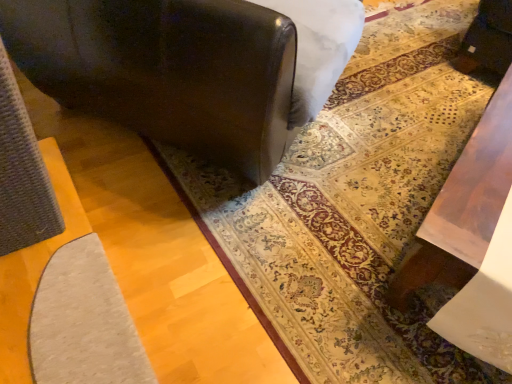
Where is `matte gray rug at center`? The image size is (512, 384). matte gray rug at center is located at coordinates (353, 208).

Image resolution: width=512 pixels, height=384 pixels. What do you see at coordinates (353, 208) in the screenshot?
I see `matte gray rug at center` at bounding box center [353, 208].

Measure the distance between point (253,137) and camera.

1.17 meters.

I want to click on matte black sofa at center, so click(x=167, y=70).

What do you see at coordinates (167, 70) in the screenshot? The width and height of the screenshot is (512, 384). I see `matte black sofa at center` at bounding box center [167, 70].

You are a GUI agent. You are given a task and a screenshot of the screen. Output one action in this format:
    pyautogui.click(x=<x>, y=<y>)
    Task: Click on the matte gray rug at center
    The height and width of the screenshot is (384, 512).
    Given the screenshot: What is the action you would take?
    pyautogui.click(x=353, y=208)

Between matte gray rug at center and matte black sofa at center, which one appears on the right side from the viewer's perspective?

matte gray rug at center is more to the right.

Based on the photo, considering the positions of objects matte gray rug at center and matte black sofa at center in the image provided, who is in front, matte gray rug at center or matte black sofa at center?

matte black sofa at center is closer to the camera.

Is point (237, 241) more distant than point (128, 97)?

Yes, it is behind point (128, 97).

From the image's perspective, is matte gray rug at center located above or below matte black sofa at center?

matte gray rug at center is situated lower than matte black sofa at center in the image.

In the scene shown: From a real-world perspective, which is physically above, matte gray rug at center or matte black sofa at center?

matte black sofa at center, from a real-world perspective.

Between matte gray rug at center and matte black sofa at center, which one has smaller width?

matte black sofa at center is thinner.

From the picture: Who is shorter, matte gray rug at center or matte black sofa at center?

Standing shorter between the two is matte gray rug at center.

Who is bigger, matte gray rug at center or matte black sofa at center?

With larger size is matte black sofa at center.

Could matte black sofa at center be considered to be inside matte gray rug at center?

Actually, matte black sofa at center is outside matte gray rug at center.

In the scene shown: Can you see matte gray rug at center touching matte black sofa at center?

There is a gap between matte gray rug at center and matte black sofa at center.

Is matte gray rug at center positioned with its back to matte black sofa at center?

matte gray rug at center does not have its back to matte black sofa at center.

What's the angular difference between matte gray rug at center and matte black sofa at center's facing directions?

The angle between the facing direction of matte gray rug at center and the facing direction of matte black sofa at center is 120 degrees.

In the image, there is a matte gray rug at center. Identify the location of furniture above it (from the image's perspective). Image resolution: width=512 pixels, height=384 pixels. (167, 70).

Can you confirm if matte black sofa at center is positioned to the left of matte gray rug at center?

Indeed, matte black sofa at center is positioned on the left side of matte gray rug at center.

From the picture: Is matte black sofa at center in front of or behind matte gray rug at center in the image?

matte black sofa at center is positioned closer to the viewer than matte gray rug at center.

Does point (85, 32) appear closer or farther from the camera than point (374, 71)?

Point (85, 32).

From the image's perspective, which object appears higher, matte black sofa at center or matte gray rug at center?

matte black sofa at center is shown above in the image.

From a real-world perspective, which object rests below the other?

In real-world perspective, matte gray rug at center is lower.

Considering the sizes of objects matte black sofa at center and matte gray rug at center in the image provided, who is thinner, matte black sofa at center or matte gray rug at center?

matte black sofa at center is thinner.

Is matte black sofa at center shorter than matte gray rug at center?

Incorrect, the height of matte black sofa at center does not fall short of that of matte gray rug at center.

Which of these two, matte black sofa at center or matte gray rug at center, is smaller?

matte gray rug at center is smaller.

Does matte black sofa at center contain matte gray rug at center?

Definitely not — matte gray rug at center is not inside matte black sofa at center.

Are matte black sofa at center and matte gray rug at center beside each other?

No, matte black sofa at center is not beside matte gray rug at center.

Does matte black sofa at center turn towards matte gray rug at center?

Yes, matte black sofa at center is oriented towards matte gray rug at center.

Locate an element on the screen. mat located below the matte black sofa at center (from the image's perspective) is located at coordinates (353, 208).

Find the location of a particular element. The height and width of the screenshot is (384, 512). mat below the matte black sofa at center (from the image's perspective) is located at coordinates (353, 208).

Identify the location of mat below the matte black sofa at center (from a real-world perspective). The width and height of the screenshot is (512, 384). (353, 208).